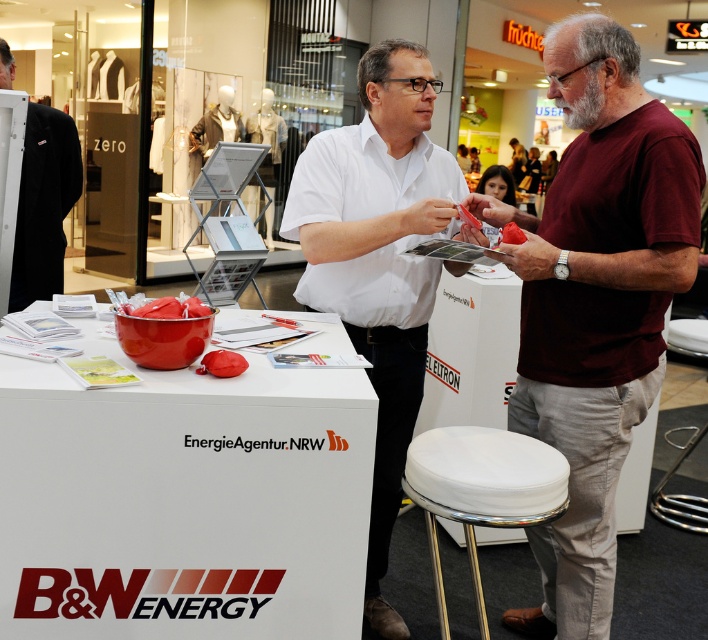
Question: Which point is farther to the camera?

Choices:
 (A) (57, 163)
 (B) (435, 564)
 (C) (554, 289)
 (D) (358, 134)

Answer: (A)

Question: Considering the relative positions of maroon t-shirt at right and white fabric stool at lower center in the image provided, where is maroon t-shirt at right located with respect to white fabric stool at lower center?

Choices:
 (A) below
 (B) above

Answer: (B)

Question: Is white matte shirt at center positioned before white fabric stool at lower center?

Choices:
 (A) no
 (B) yes

Answer: (A)

Question: Estimate the real-world distances between objects in this image. Which object is farther from the white matte shirt at center?

Choices:
 (A) white fabric stool at lower center
 (B) black fabric coat at left
 (C) maroon t-shirt at right

Answer: (B)

Question: Is maroon t-shirt at right in front of black fabric coat at left?

Choices:
 (A) no
 (B) yes

Answer: (B)

Question: Which point appears farthest from the camera in this image?

Choices:
 (A) (570, 566)
 (B) (457, 497)
 (C) (421, 147)
 (D) (30, 109)

Answer: (D)